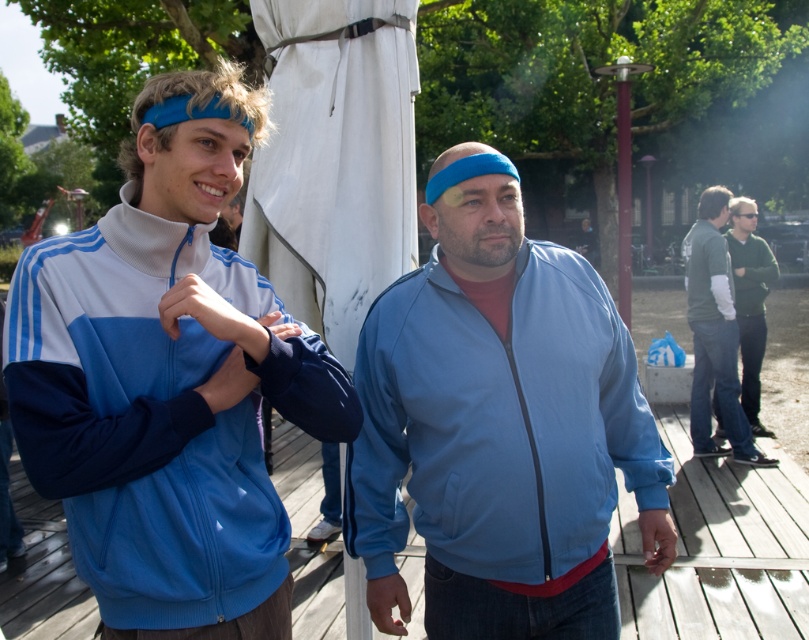
Consider the image. How far apart are blue matte jacket at center and green sweater at right?

blue matte jacket at center is 15.85 feet from green sweater at right.

Is point (450, 358) positioned before point (774, 269)?

That is True.

Which is in front, point (500, 198) or point (735, 316)?

Point (500, 198) is more forward.

Find the location of a particular element. The width and height of the screenshot is (809, 640). blue matte jacket at center is located at coordinates (498, 432).

Is matte blue track jacket at left to the right of blue matte jacket at center from the viewer's perspective?

Incorrect, matte blue track jacket at left is not on the right side of blue matte jacket at center.

The height and width of the screenshot is (640, 809). What do you see at coordinates (168, 380) in the screenshot?
I see `matte blue track jacket at left` at bounding box center [168, 380].

At what (x,y) coordinates should I click in order to perform the action: click on matte blue track jacket at left. Please return your answer as a coordinate pair (x, y). Image resolution: width=809 pixels, height=640 pixels. Looking at the image, I should click on (168, 380).

Find the location of a particular element. matte blue track jacket at left is located at coordinates (168, 380).